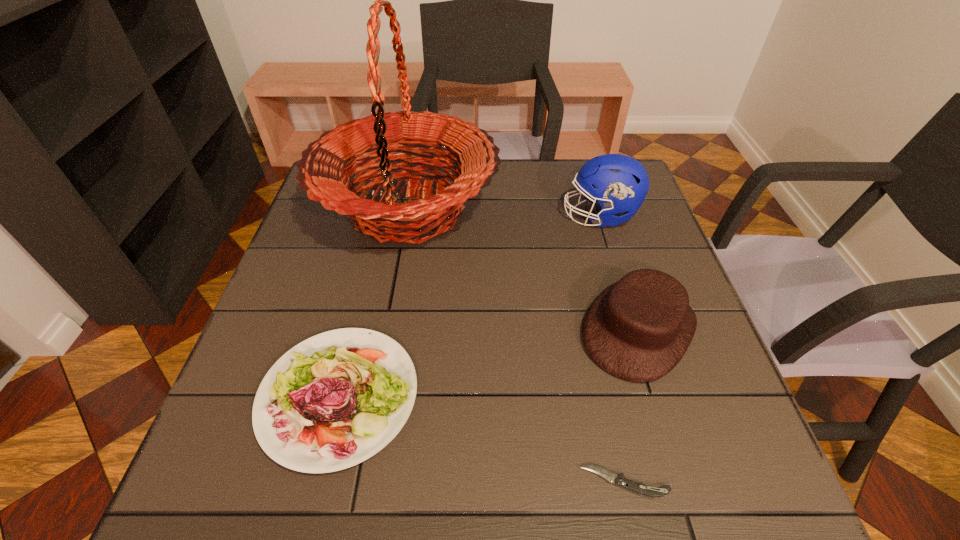
You are a GUI agent. You are given a task and a screenshot of the screen. Output one action in this format:
    pyautogui.click(x=<x>, y=<y>)
    Task: Click on the basket
    
    Given the screenshot: What is the action you would take?
    pyautogui.click(x=322, y=173)

The image size is (960, 540). Find the location of `football helmet`. football helmet is located at coordinates (x=619, y=183).

This screenshot has height=540, width=960. What are the coordinates of `hat` in the screenshot? It's located at (638, 329).

Where is `the second shortest object`? The width and height of the screenshot is (960, 540). the second shortest object is located at coordinates (367, 377).

Where is `pocketknife`? This screenshot has width=960, height=540. pocketknife is located at coordinates click(619, 480).

Image resolution: width=960 pixels, height=540 pixels. In order to click on blank space located 0.290m on the right of the basket in this screenshot , I will do `click(604, 209)`.

Locate an element on the screen. The image size is (960, 540). vacant space located 0.130m on the front-facing side of the fourth shortest object is located at coordinates (514, 215).

Find the location of a particular element. This screenshot has width=960, height=540. vacant space located 0.400m on the front-facing side of the fourth shortest object is located at coordinates (415, 215).

Where is `blank space located 0.330m on the front-facing side of the fourth shortest object`? This screenshot has width=960, height=540. blank space located 0.330m on the front-facing side of the fourth shortest object is located at coordinates (441, 215).

The width and height of the screenshot is (960, 540). In order to click on vacant area situated 0.280m on the back of the hat in this screenshot , I will do `click(601, 209)`.